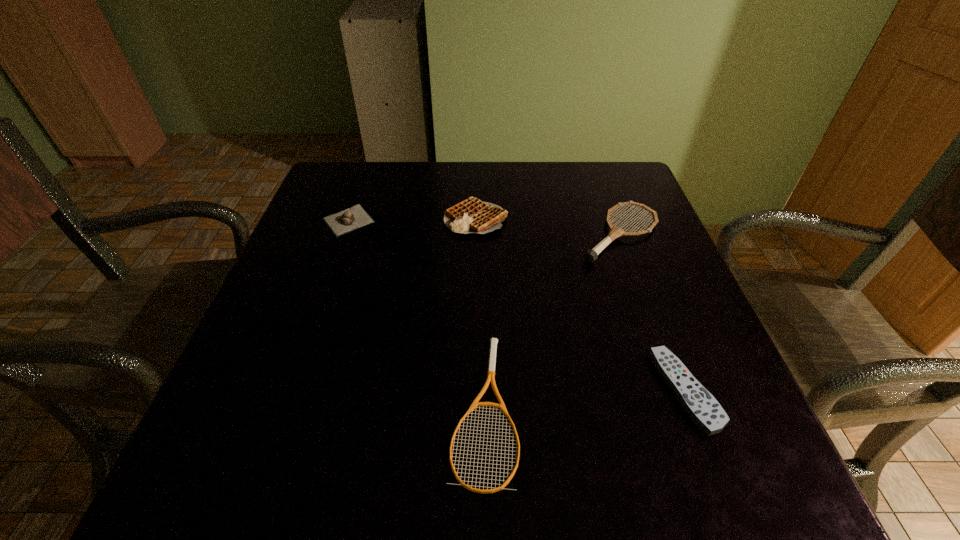
This screenshot has width=960, height=540. Identify the location of waffle. (472, 215).

Where is `the farther tennis racket`? the farther tennis racket is located at coordinates pyautogui.click(x=590, y=256).

I want to click on the second tallest object, so click(590, 256).

I want to click on the leftmost object, so click(x=353, y=218).

The image size is (960, 540). I want to click on the third tallest object, so click(x=353, y=218).

This screenshot has height=540, width=960. Find the location of `the second shortest object`. the second shortest object is located at coordinates click(x=700, y=405).

In order to click on the shortest object in this screenshot , I will do `click(493, 341)`.

Identify the location of the left tennis racket. The width and height of the screenshot is (960, 540). (493, 341).

Where is `free point located 0.110m on the right of the waffle`? This screenshot has height=540, width=960. free point located 0.110m on the right of the waffle is located at coordinates (554, 218).

Find the location of a particular element. This screenshot has width=960, height=540. vacant space located on the back of the farther tennis racket is located at coordinates (602, 186).